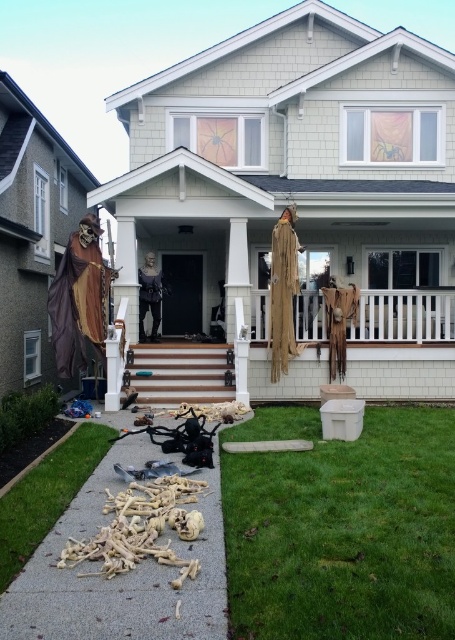
Is point (411, 570) positioned before point (145, 356)?

Yes, it is.

Does point (303, 477) come farther from viewer compared to point (167, 387)?

No, (303, 477) is closer to viewer.

Between point (274, 412) and point (222, 374), which one is positioned behind?

Positioned behind is point (222, 374).

Locate an element on the screen. green grass at lower center is located at coordinates (342, 528).

Who is higher up, green grass at lower center or light brown wood at lower left?

green grass at lower center is above.

Which is in front, point (419, 435) or point (39, 541)?

Point (39, 541) is more forward.

Who is more forward, [375,556] or [40,499]?

Point [375,556] is more forward.

Locate an element on the screen. The width and height of the screenshot is (455, 640). green grass at lower center is located at coordinates [342, 528].

Can you confirm if light brown wood at lower left is taller than white striped wood stairs at center?

No, light brown wood at lower left is not taller than white striped wood stairs at center.

Does light brown wood at lower left appear over white striped wood stairs at center?

Actually, light brown wood at lower left is below white striped wood stairs at center.

The width and height of the screenshot is (455, 640). Find the location of `light brown wood at lower left`. light brown wood at lower left is located at coordinates [46, 496].

Where is `light brown wood at lower left`? light brown wood at lower left is located at coordinates (46, 496).